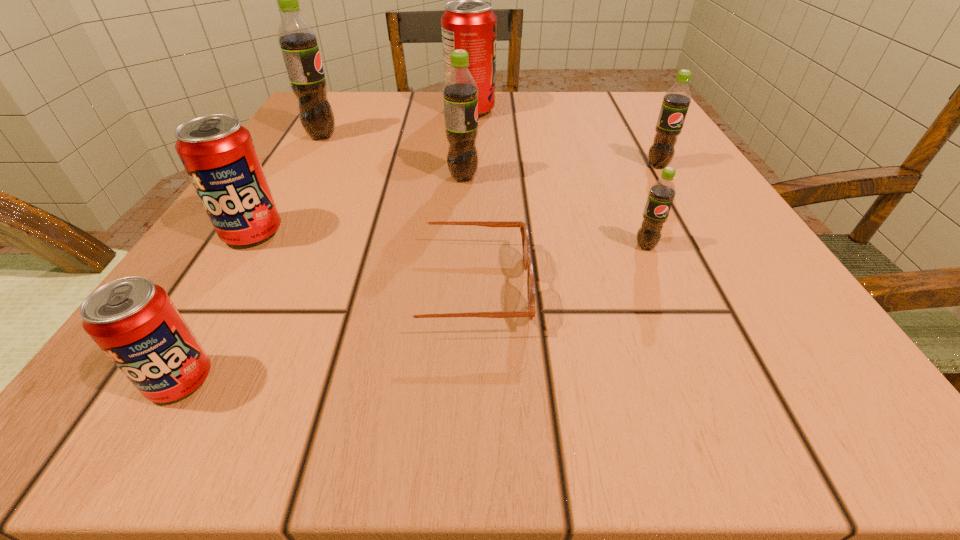
This screenshot has width=960, height=540. I want to click on free point between the second farthest red soda can and the rightmost object, so click(x=455, y=199).

At what (x,y) coordinates should I click in order to perform the action: click on object that is the fourth nearest to the second object from right to left. Please return your answer as a coordinate pair (x, y). The height and width of the screenshot is (540, 960). Looking at the image, I should click on (470, 24).

Select which object is the fifth closest to the rightmost soda can. Please provide its 2D coordinates. Your answer should be formatted as a tuple, i.e. [(x, y)], where the tuple contains the x and y coordinates of a point satisfying the conditions above.

[(299, 44)]

Locate an element on the screen. soda can that is the sixth closest to the second biggest green soda is located at coordinates (135, 323).

Where is `the second closest soda can to the third biggest green soda`? The image size is (960, 540). the second closest soda can to the third biggest green soda is located at coordinates (460, 91).

Locate an element on the screen. green soda object that ranks as the second closest to the shortest object is located at coordinates point(460,91).

Locate an element on the screen. green soda that is the closest to the biggest red soda can is located at coordinates (460, 91).

This screenshot has height=540, width=960. I want to click on red soda can that is the third closest to the sunglasses, so click(470, 24).

Choose which red soda can is the nearest neighbor to the farthest soda can. Please provide its 2D coordinates. Your answer should be formatted as a tuple, i.e. [(x, y)], where the tuple contains the x and y coordinates of a point satisfying the conditions above.

[(217, 152)]

The height and width of the screenshot is (540, 960). Find the location of `blank space that satisfies the following two spatial constraints: 1. on the front side of the nearest object; 2. on the left side of the second farthest red soda can`. blank space that satisfies the following two spatial constraints: 1. on the front side of the nearest object; 2. on the left side of the second farthest red soda can is located at coordinates (161, 380).